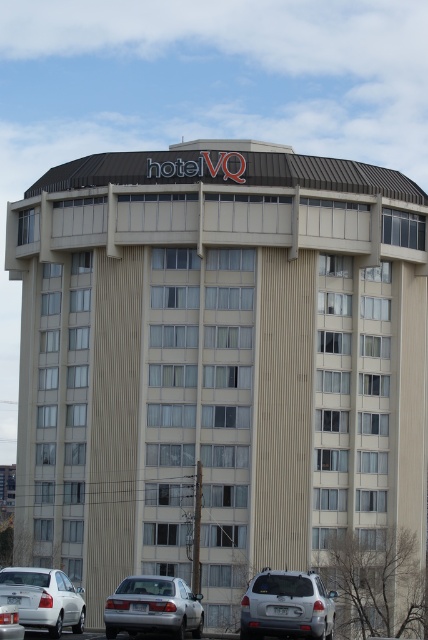
Question: In this image, where is silver metallic suv at lower center located relative to silver metallic sedan at lower left?

Choices:
 (A) below
 (B) above

Answer: (B)

Question: Can you confirm if silver metallic suv at lower center is smaller than white matte sedan at lower left?

Choices:
 (A) yes
 (B) no

Answer: (B)

Question: Which of the following is the farthest from the observer?

Choices:
 (A) silver metallic sedan at lower left
 (B) silver metallic suv at lower center
 (C) white matte sedan at lower left

Answer: (B)

Question: Which object appears farthest from the camera in this image?

Choices:
 (A) silver metallic sedan at lower left
 (B) white matte sedan at lower left
 (C) silver metallic suv at lower center

Answer: (C)

Question: Can you confirm if silver metallic suv at lower center is bigger than silver metallic sedan at lower left?

Choices:
 (A) no
 (B) yes

Answer: (A)

Question: Based on their relative distances, which object is nearer to the silver metallic sedan at lower left?

Choices:
 (A) white matte sedan at lower left
 (B) silver metallic suv at lower center

Answer: (A)